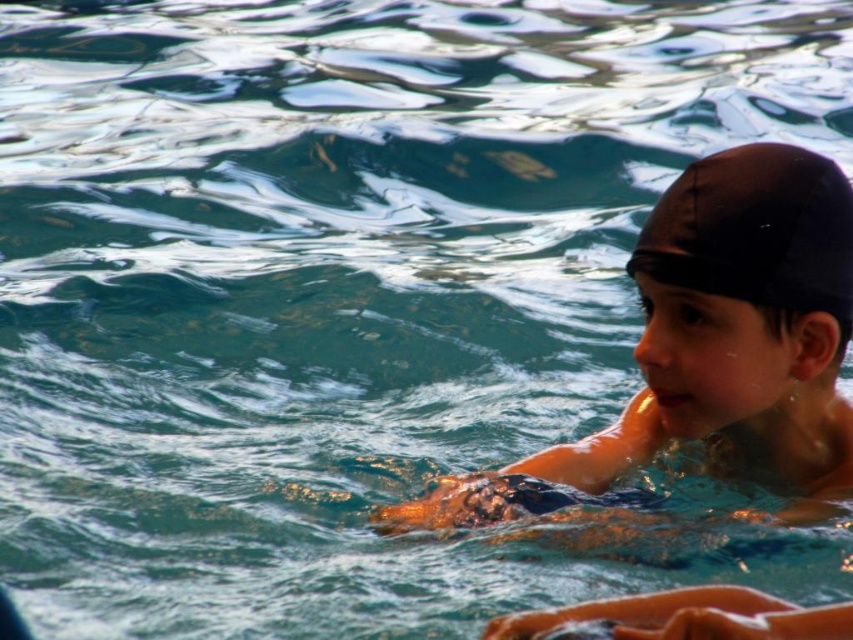
Question: Which object appears closest to the camera in this image?

Choices:
 (A) black matte swim cap at upper right
 (B) matte black swim cap at upper right

Answer: (A)

Question: Does matte black swim cap at upper right have a lesser width compared to black matte swim cap at upper right?

Choices:
 (A) no
 (B) yes

Answer: (A)

Question: Is matte black swim cap at upper right above black matte swim cap at upper right?

Choices:
 (A) yes
 (B) no

Answer: (B)

Question: Which object is closer to the camera taking this photo?

Choices:
 (A) black matte swim cap at upper right
 (B) matte black swim cap at upper right

Answer: (A)

Question: Does matte black swim cap at upper right come in front of black matte swim cap at upper right?

Choices:
 (A) yes
 (B) no

Answer: (B)